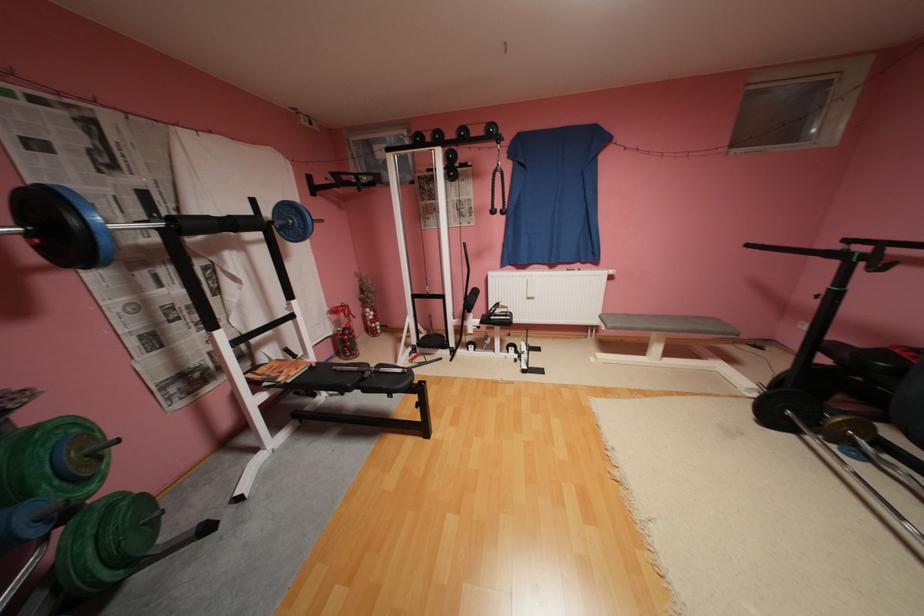
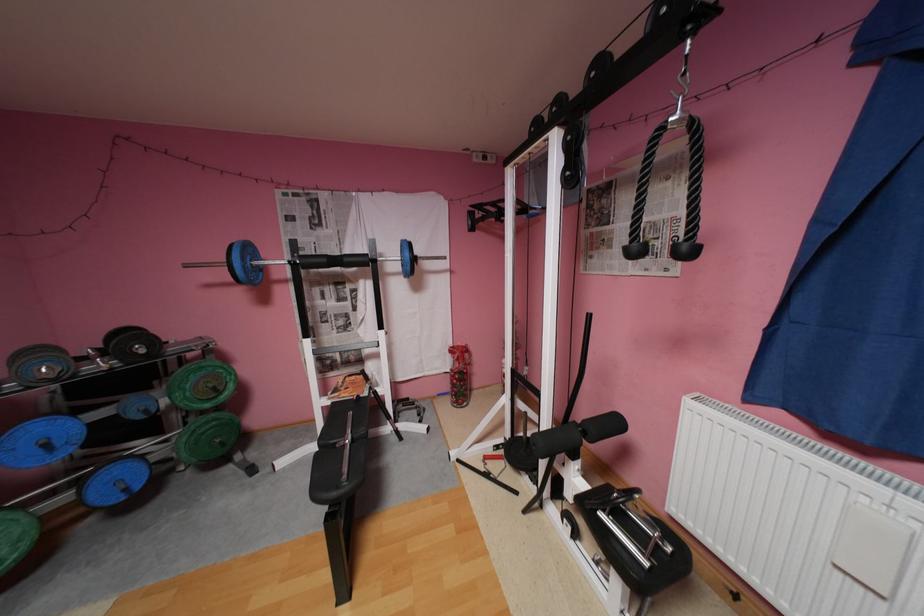
Find the pixel in the second image that matches (270,407) in the first image.

(333, 408)